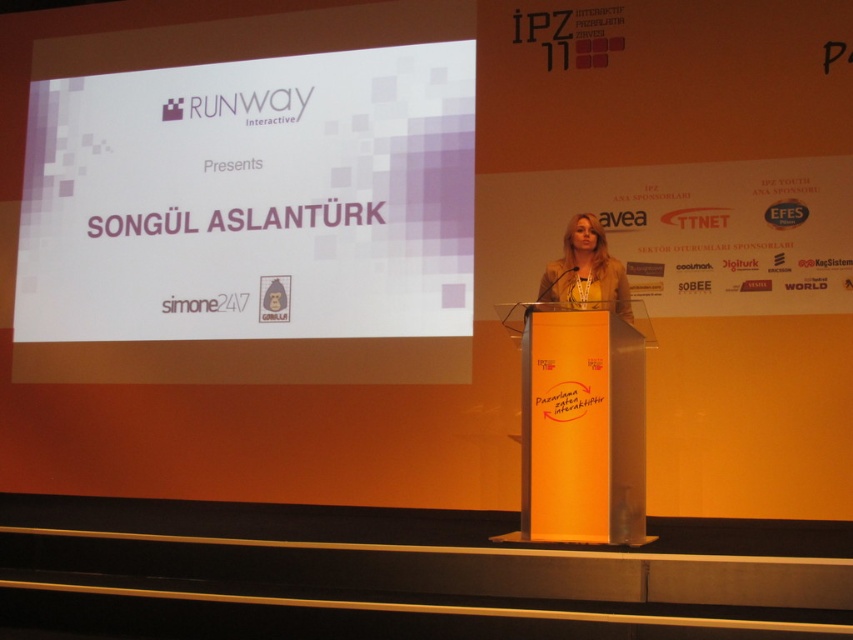
Question: Can you confirm if orange glossy podium at center is wider than matte yellow dress at center?

Choices:
 (A) yes
 (B) no

Answer: (A)

Question: Which of the following is the closest to the observer?

Choices:
 (A) white matte screen at upper center
 (B) orange glossy podium at center
 (C) matte yellow dress at center

Answer: (B)

Question: Can you confirm if orange glossy podium at center is positioned to the left of matte yellow dress at center?

Choices:
 (A) yes
 (B) no

Answer: (A)

Question: Which of the following is the closest to the observer?

Choices:
 (A) (579, 262)
 (B) (556, 412)
 (C) (129, 252)

Answer: (B)

Question: Which point is farther from the camera taking this photo?

Choices:
 (A) (532, 305)
 (B) (358, 328)

Answer: (B)

Question: Is orange glossy podium at center bigger than matte yellow dress at center?

Choices:
 (A) yes
 (B) no

Answer: (A)